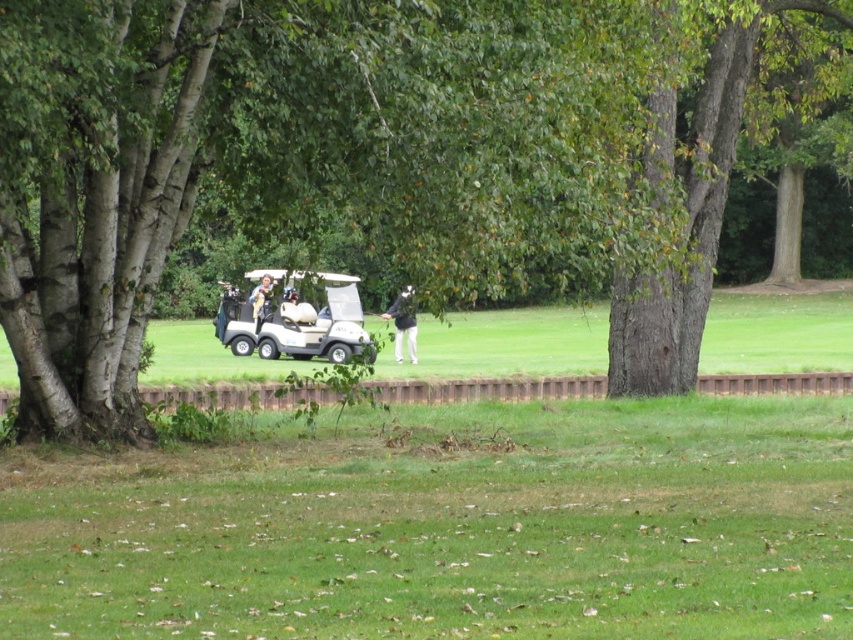
Who is positioned more to the left, dark gray pants at center or light brown leather jacket at center?

light brown leather jacket at center

Where is `dark gray pants at center`? dark gray pants at center is located at coordinates (403, 323).

You are a GUI agent. You are given a task and a screenshot of the screen. Output one action in this format:
    pyautogui.click(x=<x>, y=<y>)
    Task: Click on the dark gray pants at center
    This screenshot has height=640, width=853.
    Given the screenshot: What is the action you would take?
    pyautogui.click(x=403, y=323)

Who is taller, brown textured tree at center or light brown leather jacket at center?

brown textured tree at center is taller.

Who is shorter, brown textured tree at center or light brown leather jacket at center?

With less height is light brown leather jacket at center.

Locate an element on the screen. This screenshot has width=853, height=640. brown textured tree at center is located at coordinates (364, 161).

Based on the photo, is white matte golf cart at center bigger than dark gray pants at center?

Yes, white matte golf cart at center is bigger than dark gray pants at center.

Can you confirm if white matte golf cart at center is wider than dark gray pants at center?

Yes, white matte golf cart at center is wider than dark gray pants at center.

Who is more forward, (337, 307) or (410, 324)?

Point (410, 324) is more forward.

Identify the location of white matte golf cart at center. [x=294, y=320].